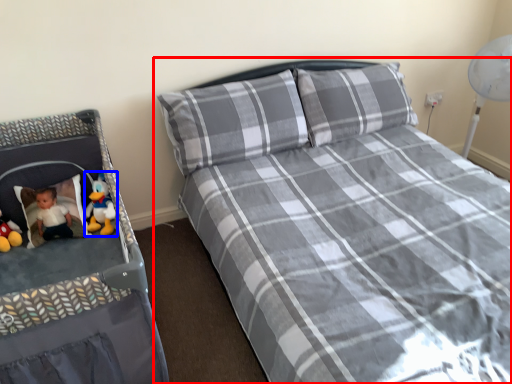
Question: Which of the following is the farthest to the observer, bed (highlighted by a red box) or toy (highlighted by a blue box)?

Choices:
 (A) bed
 (B) toy

Answer: (B)